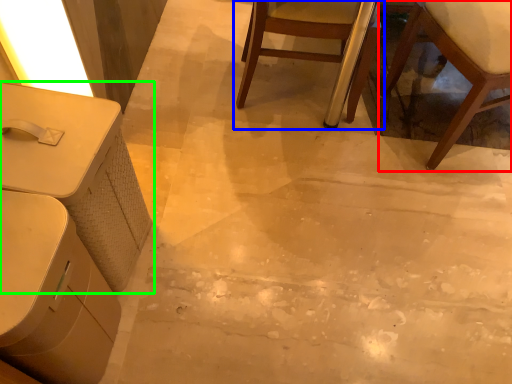
Question: Considering the real-world distances, which object is farthest from chair (highlighted by a red box)? chair (highlighted by a blue box) or table (highlighted by a green box)?

Choices:
 (A) chair
 (B) table

Answer: (B)